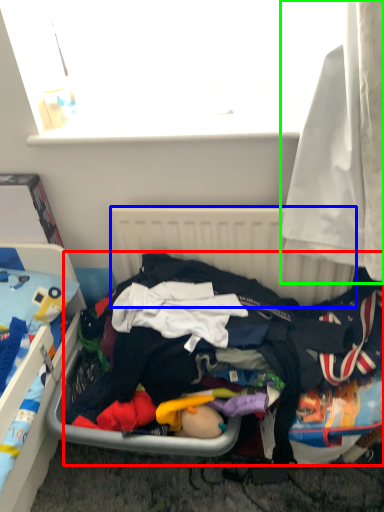
Question: Which is farther away from clothing (highlighted by a red box)? radiator (highlighted by a blue box) or curtain (highlighted by a green box)?

Choices:
 (A) radiator
 (B) curtain

Answer: (B)